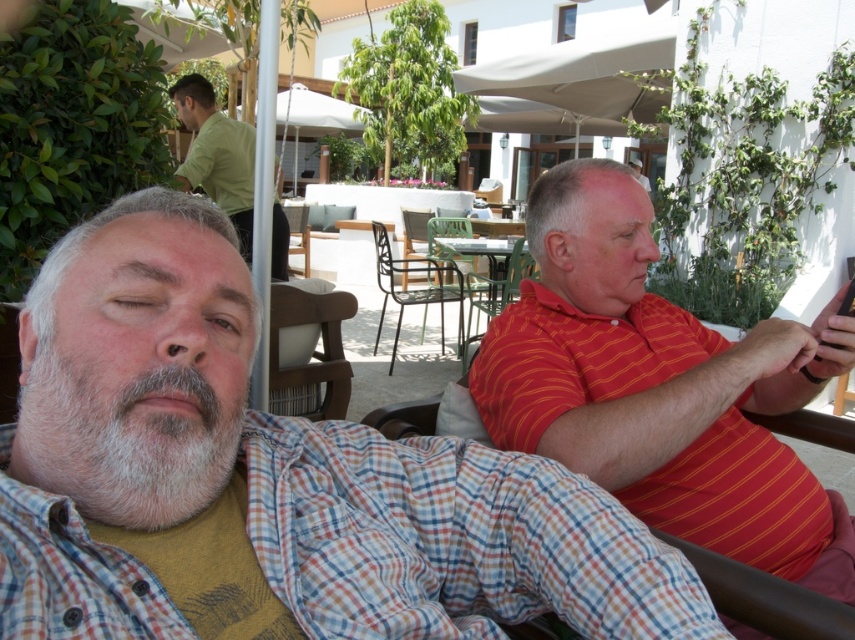
Who is positioned more to the right, green matte shirt at upper left or metallic black chair at center?

metallic black chair at center

Find the location of a particular element. green matte shirt at upper left is located at coordinates tap(216, 154).

Which is in front, point (180, 168) or point (528, 260)?

Positioned in front is point (180, 168).

Where is `green matte shirt at upper left`? This screenshot has width=855, height=640. green matte shirt at upper left is located at coordinates (216, 154).

Consider the image. Is checkered shirt at center behind red striped polo shirt at right?

No, it is not.

At what (x,y) coordinates should I click in order to perform the action: click on checkered shirt at center. Please return your answer as a coordinate pair (x, y). The height and width of the screenshot is (640, 855). Looking at the image, I should click on (274, 476).

You are a GUI agent. You are given a task and a screenshot of the screen. Output one action in this format:
    pyautogui.click(x=<x>, y=<y>)
    Task: Click on the checkered shirt at center
    This screenshot has width=855, height=640.
    Given the screenshot: What is the action you would take?
    pyautogui.click(x=274, y=476)

Can you confirm if red striped polo shirt at right is thinner than wooden chair at center?

In fact, red striped polo shirt at right might be wider than wooden chair at center.

Does red striped polo shirt at right come behind wooden chair at center?

No, it is in front of wooden chair at center.

Identify the location of red striped polo shirt at right. (653, 381).

Find the location of a particular element. The image size is (855, 640). red striped polo shirt at right is located at coordinates (653, 381).